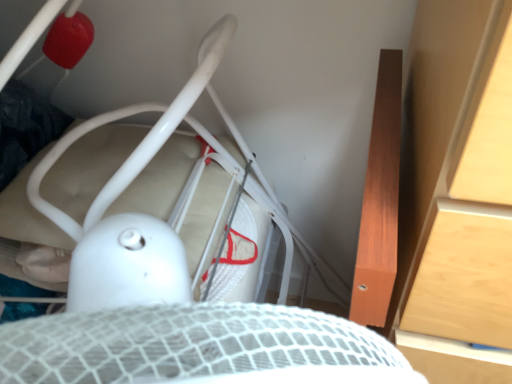
This screenshot has width=512, height=384. In order to click on wooden at right in this screenshot , I will do `click(457, 194)`.

The height and width of the screenshot is (384, 512). What do you see at coordinates (457, 194) in the screenshot?
I see `wooden at right` at bounding box center [457, 194].

You are a GUI agent. You are given a task and a screenshot of the screen. Output one action in this format:
    pyautogui.click(x=<x>, y=<y>)
    Task: Click on the wooden at right
    This screenshot has width=512, height=384.
    Given the screenshot: What is the action you would take?
    pyautogui.click(x=457, y=194)